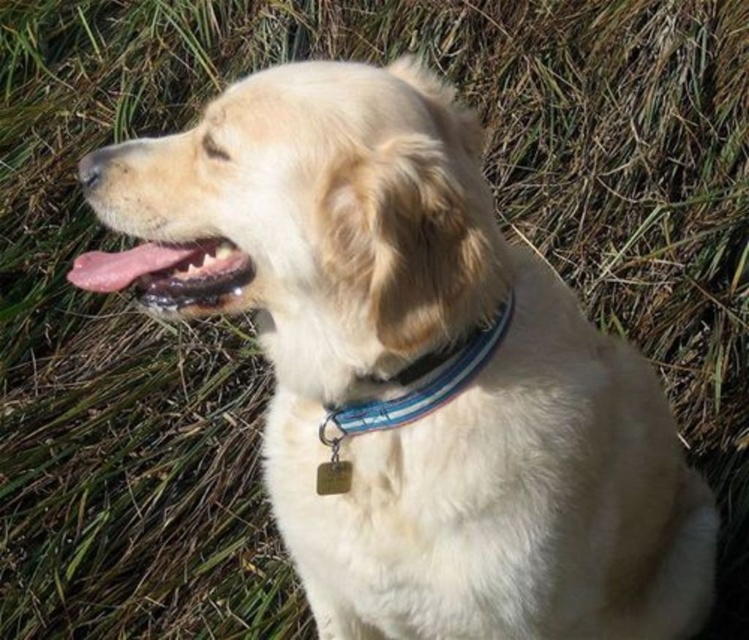
Question: Can you confirm if pink glossy tongue at center is positioned below blue fabric collar at center?

Choices:
 (A) no
 (B) yes

Answer: (A)

Question: In this image, where is pink glossy tongue at center located relative to blue fabric collar at center?

Choices:
 (A) above
 (B) below

Answer: (A)

Question: Is the position of pink glossy tongue at center less distant than that of blue fabric collar at center?

Choices:
 (A) yes
 (B) no

Answer: (A)

Question: Which of the following is the closest to the observer?

Choices:
 (A) pink glossy tongue at center
 (B) blue fabric collar at center

Answer: (A)

Question: Among these objects, which one is nearest to the camera?

Choices:
 (A) pink glossy tongue at center
 (B) blue fabric collar at center

Answer: (A)